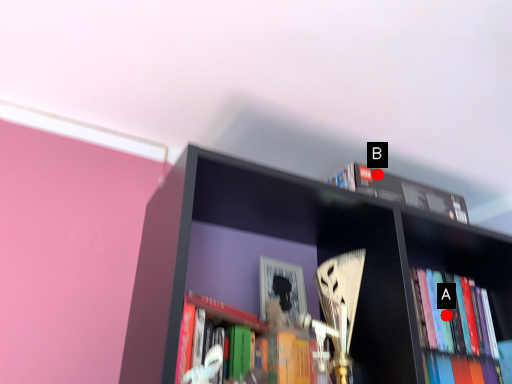
Question: Two points are circled on the image, labeled by A and B beside each circle. Which point is closer to the camera?

Choices:
 (A) A is closer
 (B) B is closer

Answer: (B)